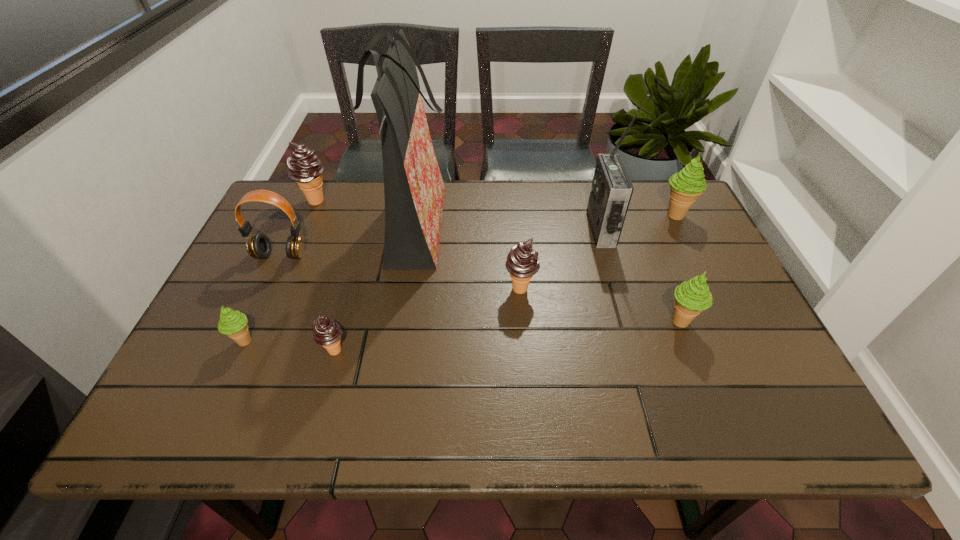
Locate an element on the screen. object that is at the far left corner is located at coordinates (304, 166).

You are a GUI agent. You are given a task and a screenshot of the screen. Output one action in this format:
    pyautogui.click(x=<x>, y=<y>)
    Task: Click on the object that is at the far right corner
    This screenshot has height=540, width=960.
    Given the screenshot: What is the action you would take?
    pyautogui.click(x=686, y=185)

The height and width of the screenshot is (540, 960). Find the location of `blank space at the far edge of the desktop`. blank space at the far edge of the desktop is located at coordinates (370, 190).

Where is `vacant space at the near edge of the desktop`? The width and height of the screenshot is (960, 540). vacant space at the near edge of the desktop is located at coordinates (550, 420).

Identify the location of free space at the left edge of the desktop. (254, 304).

What are the coordinates of `vacant space at the near left corner` in the screenshot? It's located at (179, 430).

Where is `free space that is in between the smallest green icecream and the third object from right to left`? This screenshot has width=960, height=540. free space that is in between the smallest green icecream and the third object from right to left is located at coordinates tap(422, 286).

I want to click on vacant space that's between the headset and the second chocolate icecream from left to right, so click(308, 303).

Locate an element on the screen. vacant area that lies between the rightmost green icecream and the second object from right to left is located at coordinates (678, 268).

Where is `free spot between the biggest green icecream and the second green icecream from left to right`? The width and height of the screenshot is (960, 540). free spot between the biggest green icecream and the second green icecream from left to right is located at coordinates (678, 268).